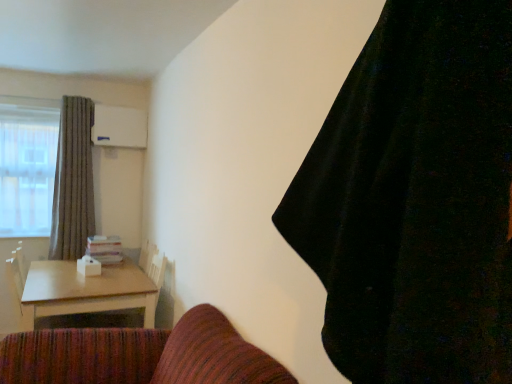
Question: Can you confirm if gray textured curtain at left, which appears as the second curtain when viewed from the right, is wider than black velvet curtain at upper right, the 1th curtain when ordered from right to left?

Choices:
 (A) no
 (B) yes

Answer: (A)

Question: From a real-world perspective, is gray textured curtain at left, marked as the first curtain in a left-to-right arrangement, on top of black velvet curtain at upper right, the 1th curtain when ordered from right to left?

Choices:
 (A) yes
 (B) no

Answer: (B)

Question: Would you say gray textured curtain at left, marked as the second curtain in a front-to-back arrangement, is a long distance from black velvet curtain at upper right, the 1th curtain when ordered from right to left?

Choices:
 (A) yes
 (B) no

Answer: (A)

Question: Would you say gray textured curtain at left, the first curtain in the back-to-front sequence, is outside black velvet curtain at upper right, the second curtain positioned from the left?

Choices:
 (A) yes
 (B) no

Answer: (A)

Question: Could you tell me if gray textured curtain at left, the first curtain in the back-to-front sequence, is turned towards black velvet curtain at upper right, the 1th curtain when ordered from right to left?

Choices:
 (A) yes
 (B) no

Answer: (A)

Question: Would you say gray textured curtain at left, marked as the first curtain in a left-to-right arrangement, contains black velvet curtain at upper right, the 1th curtain when ordered from right to left?

Choices:
 (A) yes
 (B) no

Answer: (B)

Question: Does light brown wooden table at lower left have a greater height compared to gray textured curtain at left, which appears as the second curtain when viewed from the right?

Choices:
 (A) yes
 (B) no

Answer: (B)

Question: Does light brown wooden table at lower left contain gray textured curtain at left, marked as the second curtain in a front-to-back arrangement?

Choices:
 (A) yes
 (B) no

Answer: (B)

Question: Considering the relative positions of light brown wooden table at lower left and gray textured curtain at left, marked as the second curtain in a front-to-back arrangement, in the image provided, is light brown wooden table at lower left to the right of gray textured curtain at left, marked as the second curtain in a front-to-back arrangement, from the viewer's perspective?

Choices:
 (A) no
 (B) yes

Answer: (B)

Question: Does light brown wooden table at lower left have a lesser height compared to gray textured curtain at left, marked as the second curtain in a front-to-back arrangement?

Choices:
 (A) yes
 (B) no

Answer: (A)

Question: Would you say light brown wooden table at lower left is a long distance from gray textured curtain at left, the first curtain in the back-to-front sequence?

Choices:
 (A) yes
 (B) no

Answer: (B)

Question: Is light brown wooden table at lower left turned away from gray textured curtain at left, marked as the second curtain in a front-to-back arrangement?

Choices:
 (A) no
 (B) yes

Answer: (A)

Question: Is light brown wooden table at lower left oriented towards black velvet curtain at upper right, the 1th curtain when ordered from right to left?

Choices:
 (A) yes
 (B) no

Answer: (B)